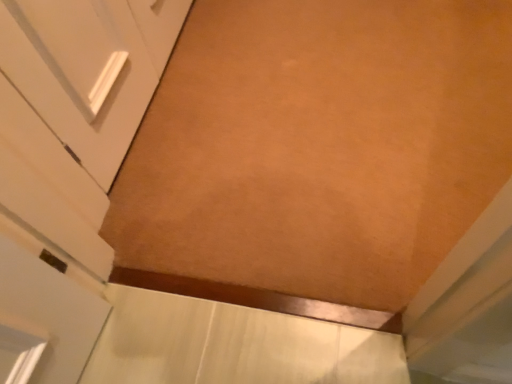
Describe the element at coordinates (316, 153) in the screenshot. I see `brown matte plywood at center` at that location.

What is the approximate height of brown matte plywood at center?

2.03 centimeters.

I want to click on brown matte plywood at center, so click(316, 153).

What is the approximate width of brown matte plywood at center?

It is 3.69 feet.

This screenshot has height=384, width=512. In order to click on brown matte plywood at center in this screenshot , I will do `click(316, 153)`.